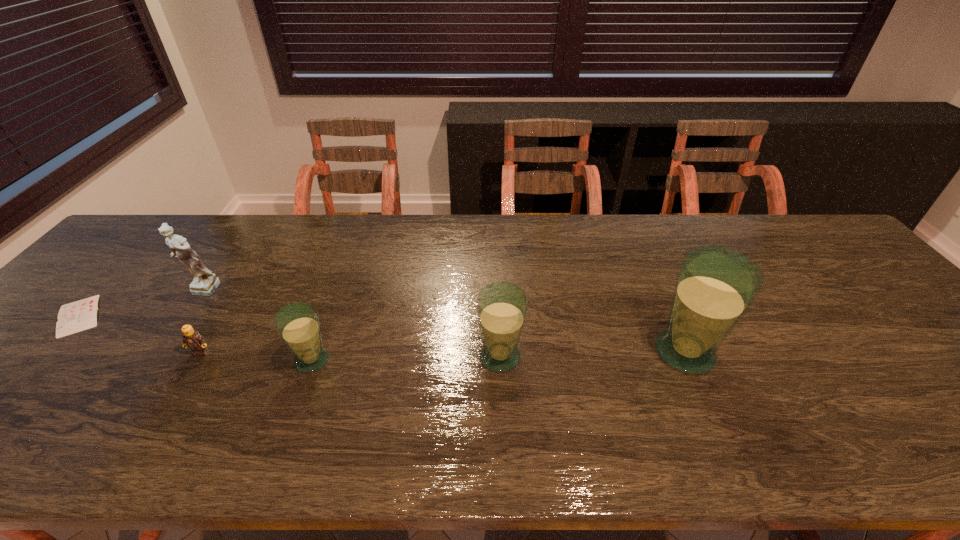
This screenshot has height=540, width=960. Identify the location of the third closest object relative to the third tallest object. (192, 339).

Find the location of `object that is the second closest to the rightmost glass`. object that is the second closest to the rightmost glass is located at coordinates (297, 323).

Select which glass appears as the second closest to the Lego. Please provide its 2D coordinates. Your answer should be formatted as a tuple, i.e. [(x, y)], where the tuple contains the x and y coordinates of a point satisfying the conditions above.

[(502, 307)]

Choose which glass is the nearest neighbor to the Lego. Please provide its 2D coordinates. Your answer should be formatted as a tuple, i.e. [(x, y)], where the tuple contains the x and y coordinates of a point satisfying the conditions above.

[(297, 323)]

Find the location of a particular element. The image size is (960, 540). vacant space that satisfies the following two spatial constraints: 1. on the front-facing side of the fourth object from left to right; 2. on the right side of the second object from left to right is located at coordinates coord(154,360).

Where is `vacant space that satisfies the following two spatial constraints: 1. in front of the third shortest object; 2. on the left side of the third object from left to right`? This screenshot has height=540, width=960. vacant space that satisfies the following two spatial constraints: 1. in front of the third shortest object; 2. on the left side of the third object from left to right is located at coordinates (197, 360).

The width and height of the screenshot is (960, 540). Identify the location of free spot that satisfies the following two spatial constraints: 1. in front of the third object from left to right; 2. on the left side of the third tallest object. (199, 356).